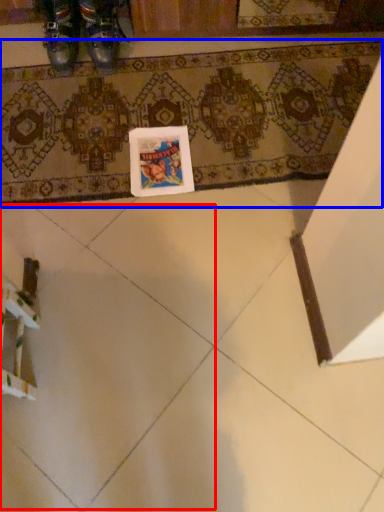
Question: Which point is further to the camera, ceramic tile (highlighted by a red box) or bath mat (highlighted by a blue box)?

Choices:
 (A) ceramic tile
 (B) bath mat

Answer: (B)